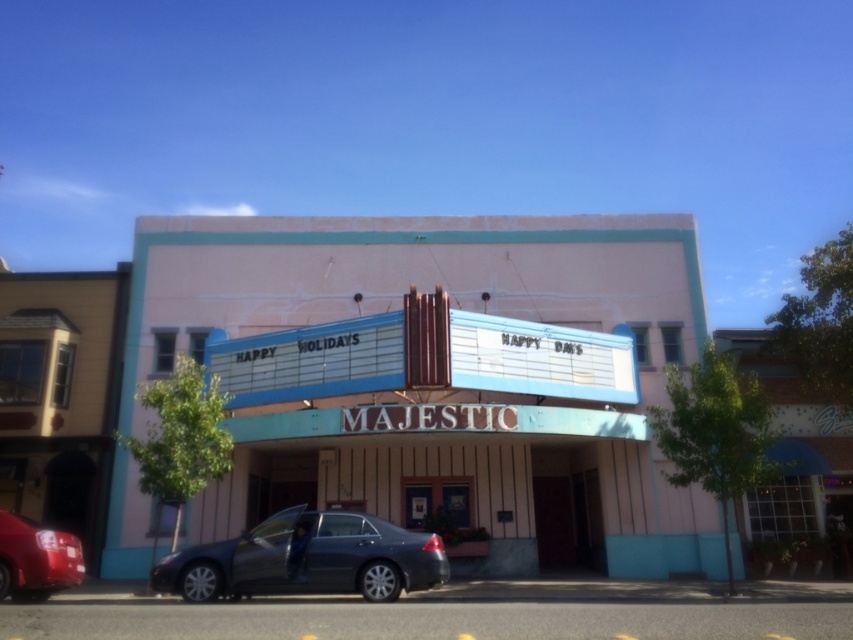
Is pink painted theater at center bigger than shiny black sedan at center?

Yes, pink painted theater at center is bigger than shiny black sedan at center.

Is pink painted theater at center further to camera compared to shiny black sedan at center?

That is True.

What do you see at coordinates (439, 374) in the screenshot?
I see `pink painted theater at center` at bounding box center [439, 374].

At what (x,y) coordinates should I click in order to perform the action: click on pink painted theater at center. Please return your answer as a coordinate pair (x, y). The image size is (853, 640). Looking at the image, I should click on (439, 374).

Can you confirm if shiny black sedan at center is positioned above shiny red sedan at lower left?

No.

Identify the location of shiny black sedan at center. The width and height of the screenshot is (853, 640). (306, 560).

I want to click on shiny black sedan at center, so pos(306,560).

Which is above, pink painted theater at center or shiny red sedan at lower left?

pink painted theater at center

Between pink painted theater at center and shiny red sedan at lower left, which one appears on the left side from the viewer's perspective?

shiny red sedan at lower left

Who is more distant from viewer, (281, 308) or (49, 536)?

The point (281, 308) is more distant.

This screenshot has height=640, width=853. What are the coordinates of `pink painted theater at center` in the screenshot? It's located at (439, 374).